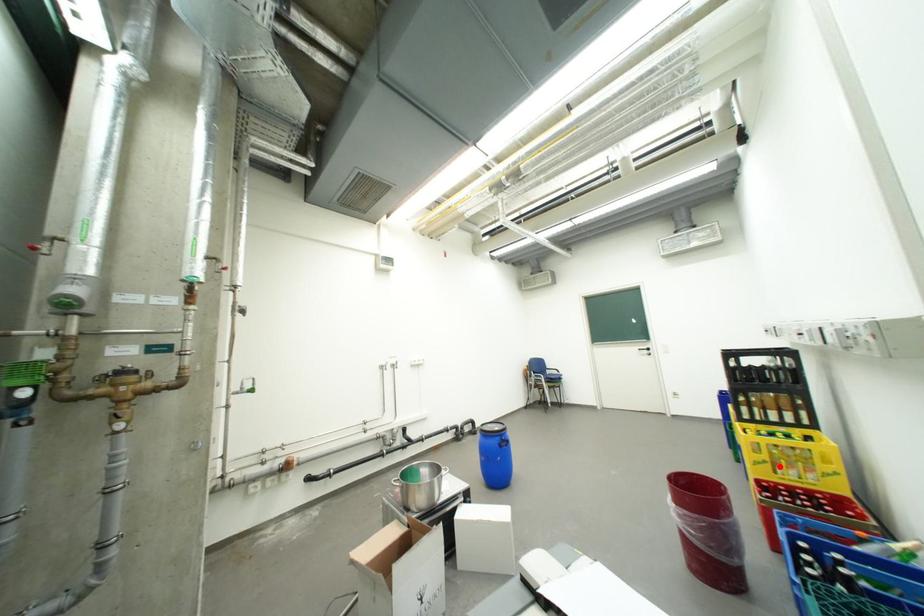
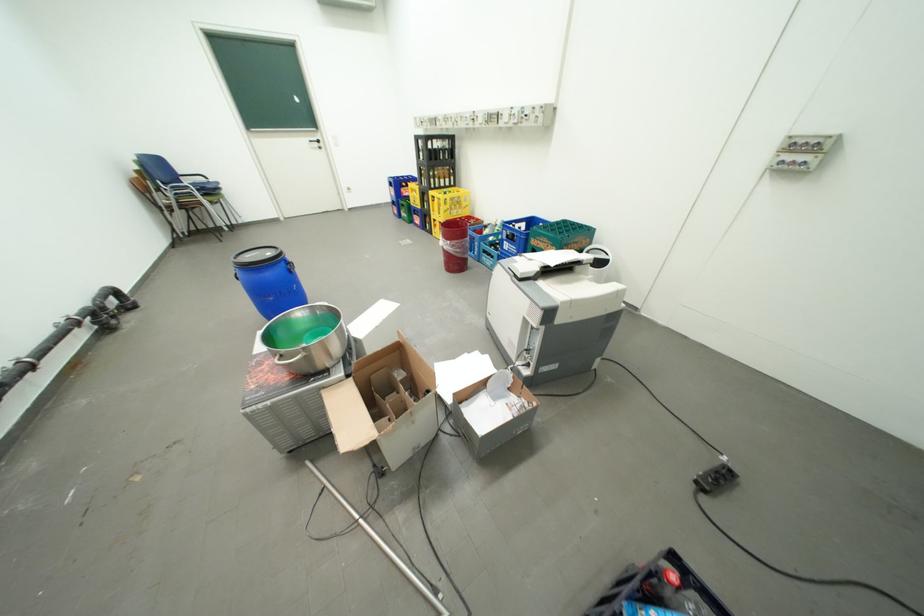
Question: I am providing you with two images of the same scene from different viewpoints. A red point is shown in image1. For the corresponding object point in image2, is it positioned nearer or farther from the camera?

Choices:
 (A) Nearer
 (B) Farther

Answer: (B)